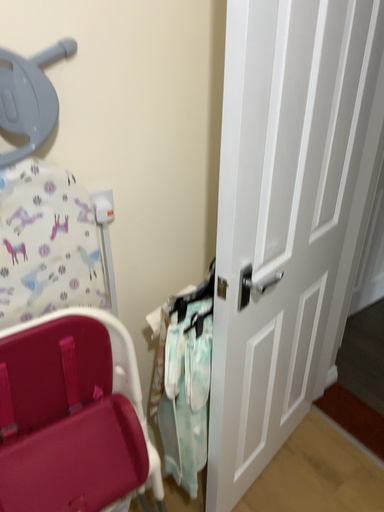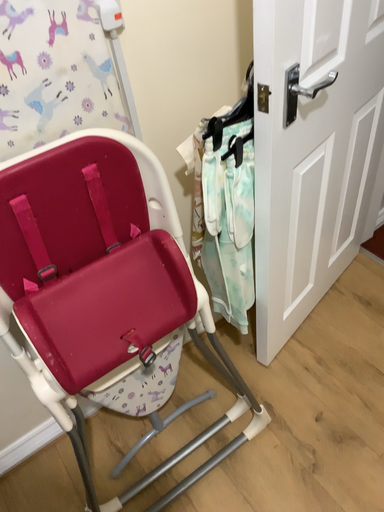
Question: Which way did the camera rotate in the video?

Choices:
 (A) rotated upward
 (B) rotated downward

Answer: (B)